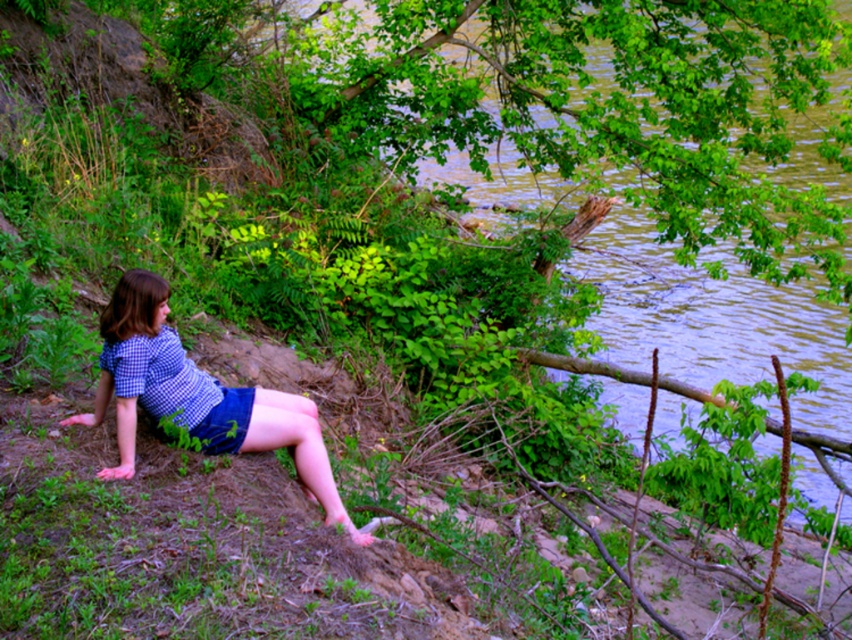
Measure the distance between point (251, 417) and camera.

A distance of 4.51 meters exists between point (251, 417) and camera.

At what (x,y) coordinates should I click in order to perform the action: click on blue checkered shirt at center. Please return your answer as a coordinate pair (x, y). Looking at the image, I should click on (197, 396).

Image resolution: width=852 pixels, height=640 pixels. What do you see at coordinates (197, 396) in the screenshot? I see `blue checkered shirt at center` at bounding box center [197, 396].

Where is `blue checkered shirt at center`? The height and width of the screenshot is (640, 852). blue checkered shirt at center is located at coordinates (197, 396).